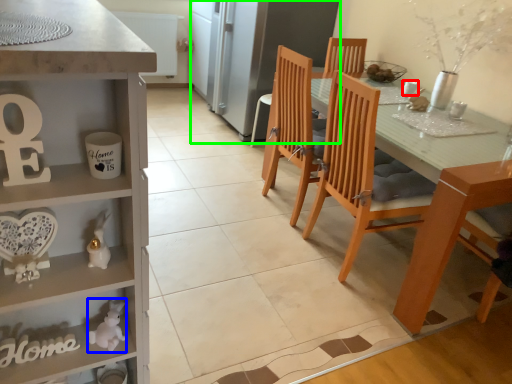
Question: Which object is the closest to the coffee cup (highlighted by a red box)? Choose among these: toy (highlighted by a blue box) or fridge (highlighted by a green box).

Choices:
 (A) toy
 (B) fridge

Answer: (B)